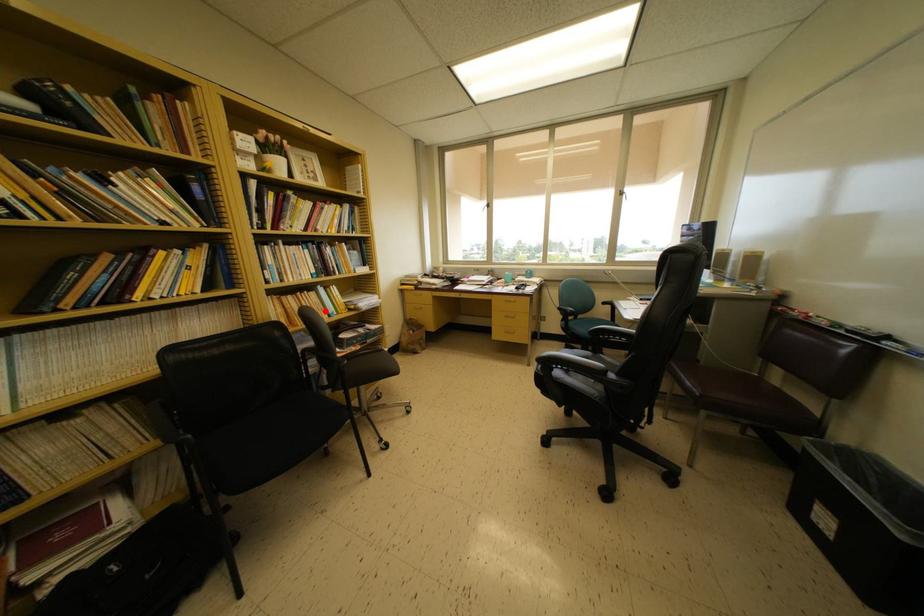
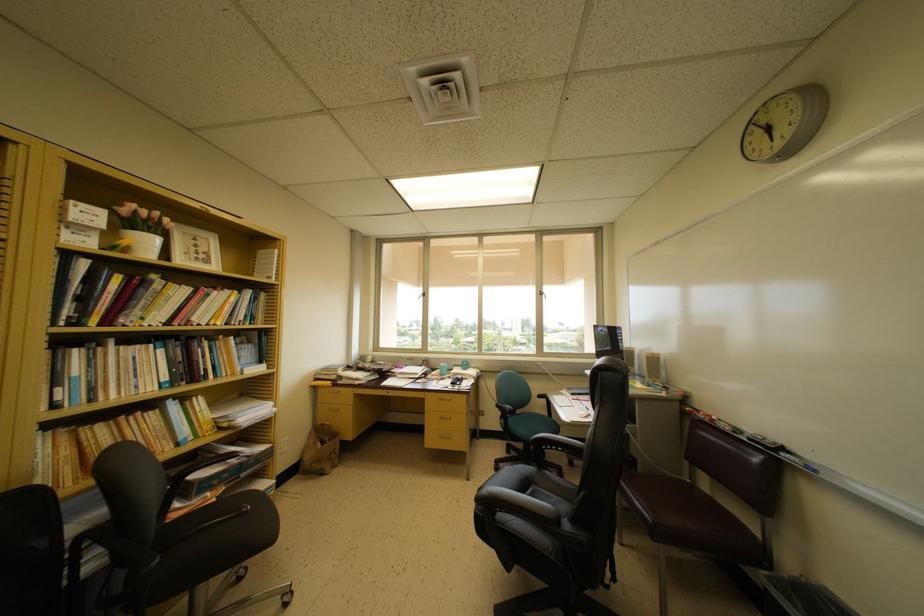
Question: I am providing you with two images of the same scene from different viewpoints. A red point is marked on the first image. Is the red point's position out of view in image 2?

Choices:
 (A) Yes
 (B) No

Answer: (B)